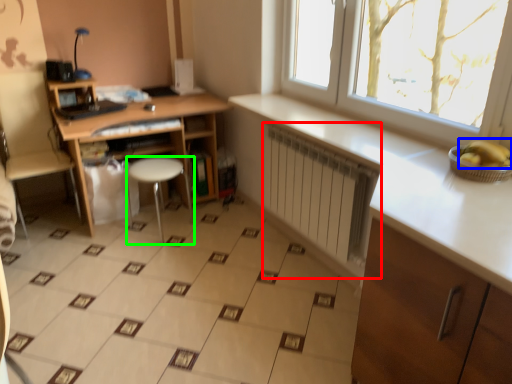
Question: Estimate the real-world distances between objects in this image. Which object is farther from radiator (highlighted by a red box), banana (highlighted by a blue box) or stool (highlighted by a green box)?

Choices:
 (A) banana
 (B) stool

Answer: (B)